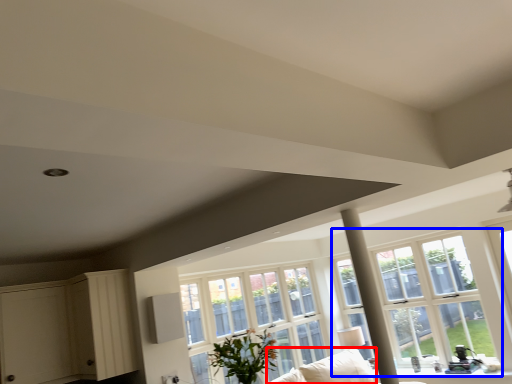
Question: Which point is further to the camera, couch (highlighted by a red box) or window (highlighted by a blue box)?

Choices:
 (A) couch
 (B) window

Answer: (B)